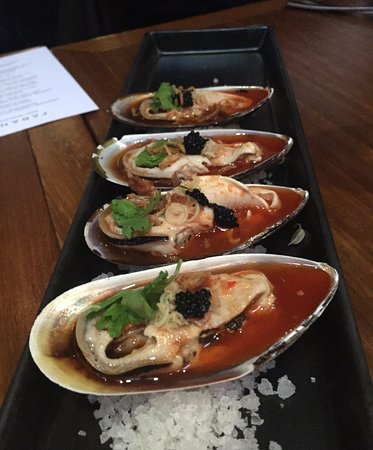
Locate an element on the screen. black plate is located at coordinates (53, 415).